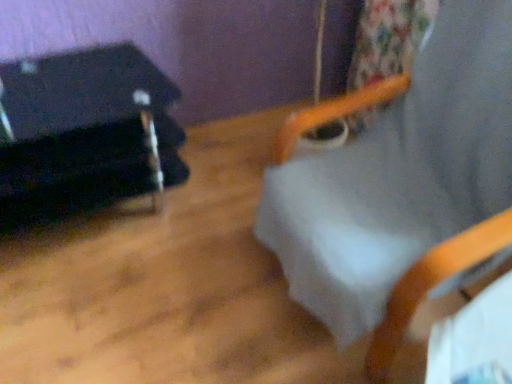
Find the location of a particular element. The width and height of the screenshot is (512, 384). vacant space to the right of black fabric at left is located at coordinates coord(200,251).